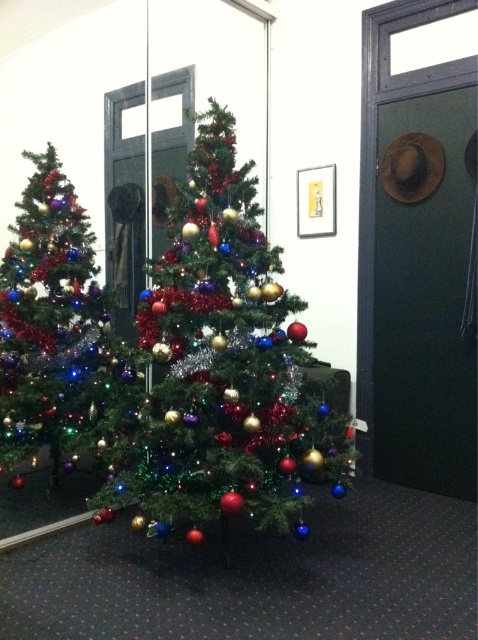
Question: Which object appears farthest from the camera in this image?

Choices:
 (A) shiny green christmas tree at center
 (B) shiny tinsel christmas tree at left

Answer: (B)

Question: Does shiny green christmas tree at center have a larger size compared to shiny tinsel christmas tree at left?

Choices:
 (A) no
 (B) yes

Answer: (B)

Question: Which object appears farthest from the camera in this image?

Choices:
 (A) shiny green christmas tree at center
 (B) shiny tinsel christmas tree at left

Answer: (B)

Question: Does shiny green christmas tree at center have a greater width compared to shiny tinsel christmas tree at left?

Choices:
 (A) yes
 (B) no

Answer: (A)

Question: Does shiny green christmas tree at center have a larger size compared to shiny tinsel christmas tree at left?

Choices:
 (A) no
 (B) yes

Answer: (B)